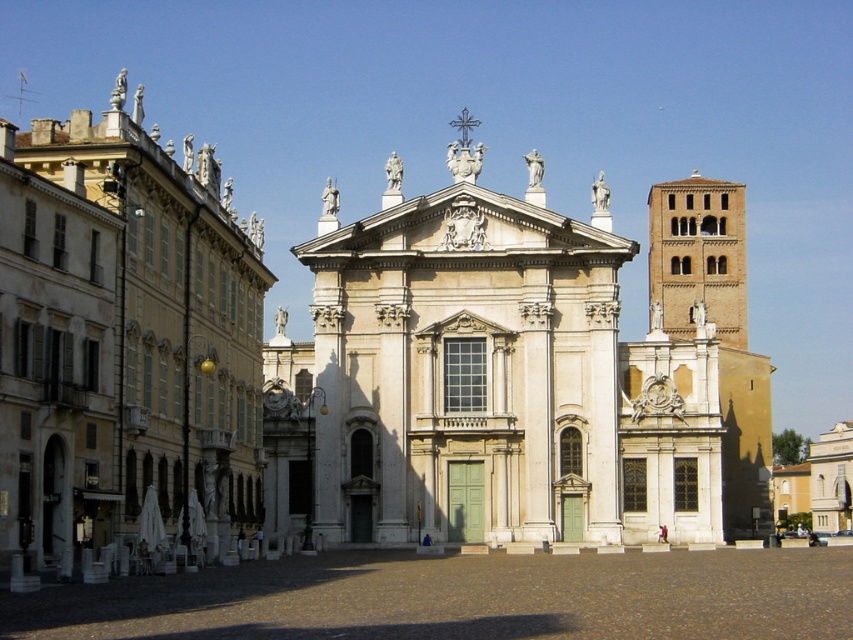
You are standing in the city square and want to take a photo of both the beige stone church at center and the beige stone church at left. If you need to be equidistant from both to capture them clearly, where should you position yourself?

You should position yourself exactly halfway between the beige stone church at center and the beige stone church at left, which are 72.31 feet apart. This midpoint will ensure you are equidistant from both churches, allowing them to be captured clearly in your photo.

You are standing in the city square and want to take a photo of the beige stone church at center and the brown brick tower at upper right. Which object should you focus on first if you want to capture both in a single frame without moving the camera?

The beige stone church at center is above the brown brick tower at upper right, so you should focus on the beige stone church at center first to ensure both are in the frame.